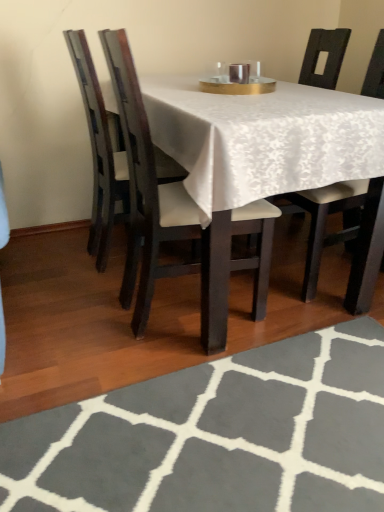
Locate an element on the screen. The image size is (384, 512). free location in front of dark wood chair at center, which is the 2th chair in right-to-left order is located at coordinates (174, 395).